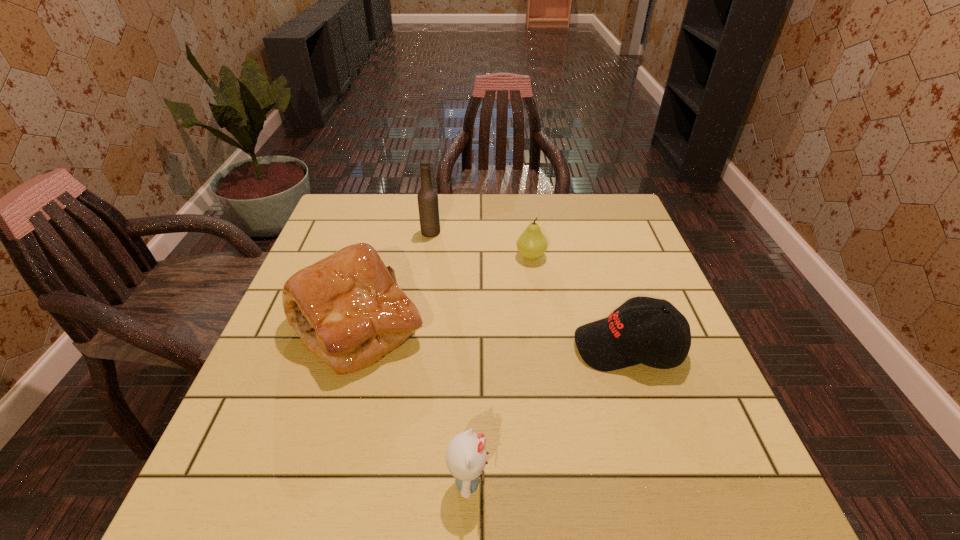
Find the location of `free space at the near edge of the desktop`. free space at the near edge of the desktop is located at coordinates (552, 518).

Where is `free space at the left edge of the desktop`? The image size is (960, 540). free space at the left edge of the desktop is located at coordinates (311, 393).

Find the location of a particular element. This screenshot has width=960, height=540. vacant space at the right edge of the desktop is located at coordinates (689, 416).

Image resolution: width=960 pixels, height=540 pixels. I want to click on vacant space at the far left corner, so click(x=334, y=214).

In the image, there is a desktop. In order to click on free space at the near left corner in this screenshot , I will do `click(206, 520)`.

I want to click on free space at the near right corner of the desktop, so click(x=756, y=490).

You are a GUI agent. You are given a task and a screenshot of the screen. Output one action in this format:
    pyautogui.click(x=<x>, y=<y>)
    Task: Click on the vacant area that lies between the tallest object and the third object from right to left
    Image resolution: width=960 pixels, height=540 pixels.
    Given the screenshot: What is the action you would take?
    pyautogui.click(x=449, y=356)

Identify the location of free space between the rightmost object and the fourth object from left to right. (580, 301).

At what (x,y) coordinates should I click in order to perform the action: click on free space between the baseball cap and the tallest object. Please return your answer as a coordinate pair (x, y). The image size is (960, 540). Looking at the image, I should click on (529, 290).

I want to click on unoccupied area between the rightmost object and the farthest object, so click(529, 290).